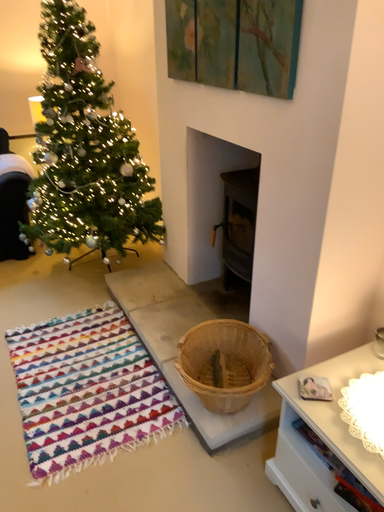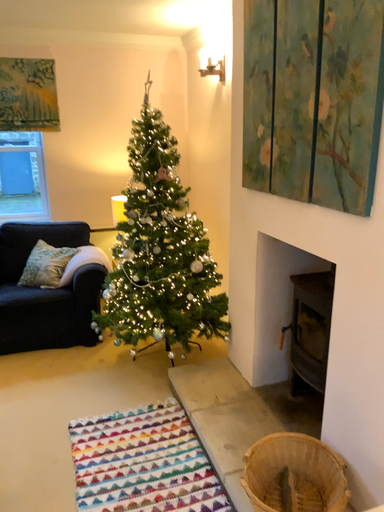
Question: Which way did the camera rotate in the video?

Choices:
 (A) rotated right
 (B) rotated left

Answer: (B)